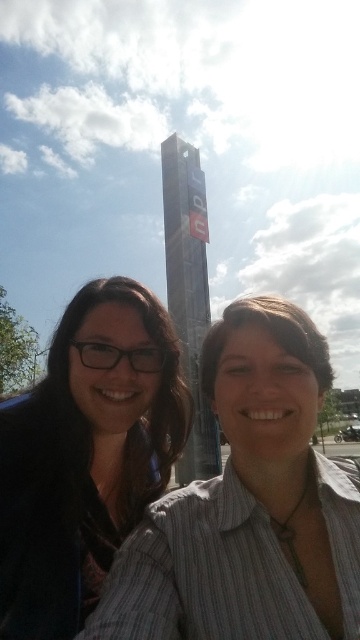
Question: Among these objects, which one is farthest from the camera?

Choices:
 (A) matte black glasses at left
 (B) striped shirt at center
 (C) metallic glass tower at center

Answer: (C)

Question: Does striped shirt at center appear on the left side of matte black glasses at left?

Choices:
 (A) yes
 (B) no

Answer: (B)

Question: Which of the following is the closest to the observer?

Choices:
 (A) (141, 332)
 (B) (309, 637)
 (C) (199, 253)

Answer: (B)

Question: Which object is farther from the camera taking this photo?

Choices:
 (A) striped shirt at center
 (B) matte black glasses at left

Answer: (A)

Question: Can you confirm if striped shirt at center is positioned below matte black glasses at left?

Choices:
 (A) yes
 (B) no

Answer: (B)

Question: Is striped shirt at center thinner than matte black glasses at left?

Choices:
 (A) yes
 (B) no

Answer: (A)